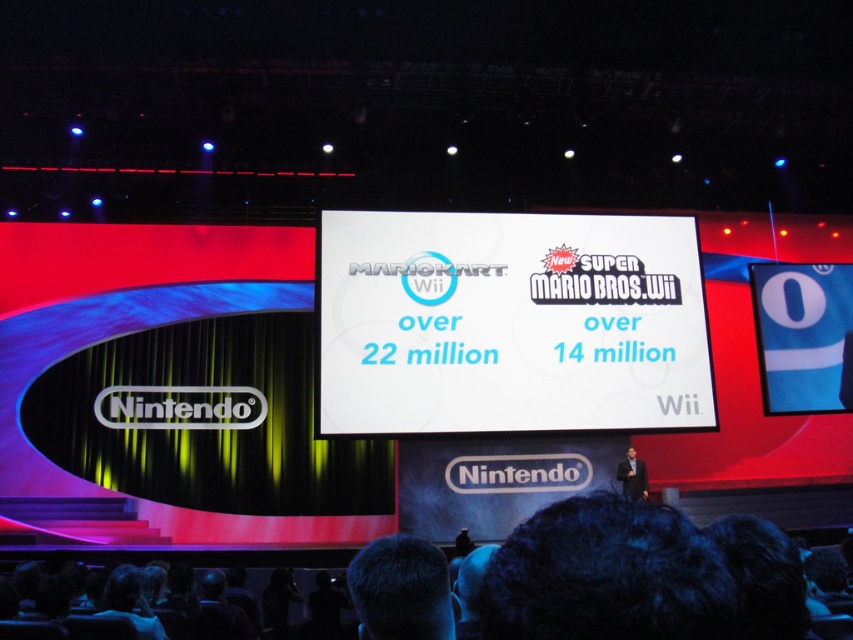
Question: Does white glossy projection screen at center have a lesser width compared to dark suit at lower right?

Choices:
 (A) no
 (B) yes

Answer: (A)

Question: Can you confirm if white glossy projection screen at center is positioned to the right of dark suit at lower right?

Choices:
 (A) no
 (B) yes

Answer: (A)

Question: Can you confirm if white glossy projection screen at center is wider than blue fabric at center?

Choices:
 (A) no
 (B) yes

Answer: (B)

Question: Which point appears closest to the camera in this image?

Choices:
 (A) (779, 316)
 (B) (595, 396)
 (C) (642, 464)

Answer: (B)

Question: Which of the following is the closest to the observer?

Choices:
 (A) white glossy projection screen at center
 (B) dark suit at lower right
 (C) blue fabric at center

Answer: (A)

Question: Estimate the real-world distances between objects in this image. Which object is farther from the dark suit at lower right?

Choices:
 (A) white glossy projection screen at center
 (B) blue fabric at center

Answer: (B)